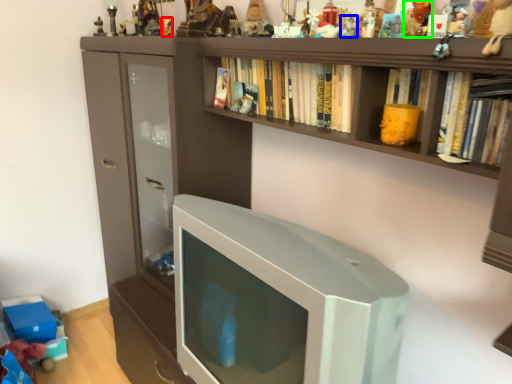
Question: Estimate the real-world distances between objects in this image. Which object is closer to toy (highlighted by a red box), toy (highlighted by a blue box) or toy (highlighted by a green box)?

Choices:
 (A) toy
 (B) toy

Answer: (A)